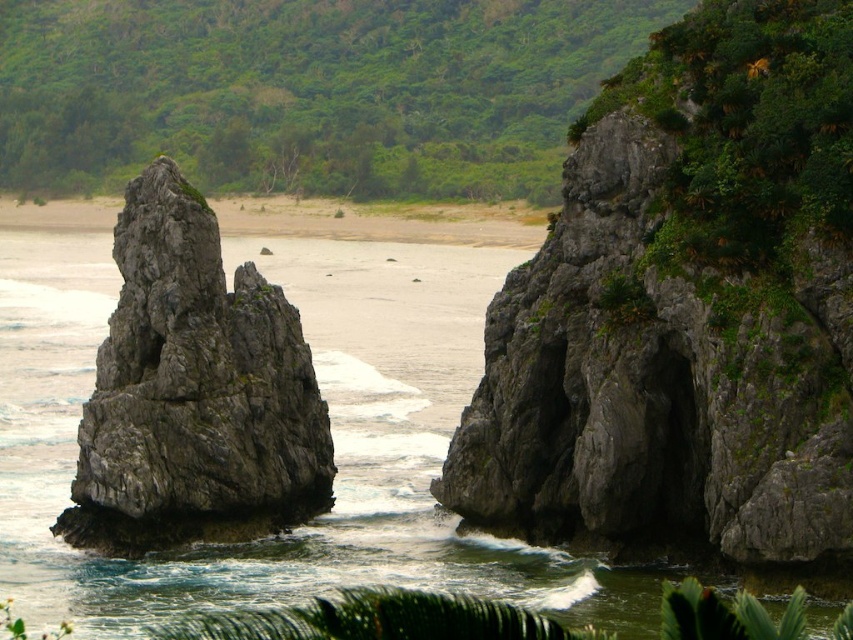
You are a hiker standing on the beach and want to reach the gray rough rock at left from the green leafy vegetation at upper center. Can you walk directly to it without crossing any water?

The distance between the green leafy vegetation at upper center and the gray rough rock at left is 400.73 feet. Since the gray rough rock at left is surrounded by water, you would need to cross the water to reach it, which is not advisable due to safety concerns.

You are a kayaker approaching the coastal landscape. You see the greenish water at center and the gray rough rock at left. Which one is closer to your right side as you face the shore?

The gray rough rock at left is to the right of the greenish water at center, so it would be closer to your right side as you face the shore.